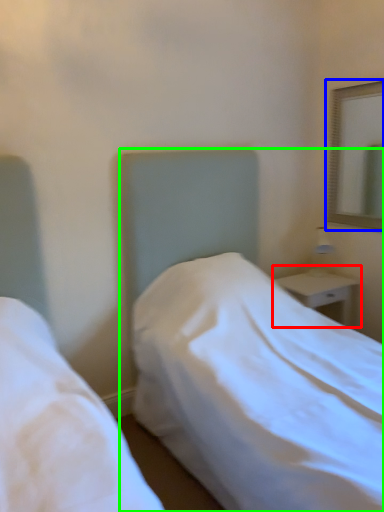
Question: Which object is positioned farthest from nightstand (highlighted by a red box)? Select from mirror (highlighted by a blue box) and bed (highlighted by a green box).

Choices:
 (A) mirror
 (B) bed

Answer: (A)